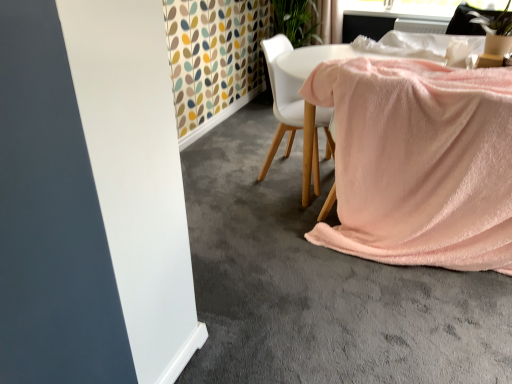
Image resolution: width=512 pixels, height=384 pixels. What do you see at coordinates (316, 58) in the screenshot?
I see `pink soft fabric at center` at bounding box center [316, 58].

Identify the location of pink soft blanket at lower right. This screenshot has height=384, width=512. (319, 284).

Measure the distance between green leafy plant at upper right and camera.

2.68 meters.

Measure the distance between white fabric chair at center and camera.

white fabric chair at center and camera are 7.30 feet apart from each other.

Identify the location of pink soft fabric at center. (316, 58).

How different are the orientations of white fabric chair at center and green leafy plant at upper right in degrees?

The angle between the facing direction of white fabric chair at center and the facing direction of green leafy plant at upper right is 89.3 degrees.

This screenshot has height=384, width=512. I want to click on plant lying above the white fabric chair at center (from the image's perspective), so click(494, 22).

Which object is more forward, white fabric chair at center or green leafy plant at upper right?

green leafy plant at upper right is closer to the camera.

Is white fabric chair at center bigger or smaller than green leafy plant at upper right?

In the image, white fabric chair at center appears to be larger than green leafy plant at upper right.

Considering the relative sizes of pink soft fabric at center and pink soft blanket at lower right in the image provided, is pink soft fabric at center shorter than pink soft blanket at lower right?

No, pink soft fabric at center is not shorter than pink soft blanket at lower right.

Can you tell me how much pink soft fabric at center and pink soft blanket at lower right differ in facing direction?

The facing directions of pink soft fabric at center and pink soft blanket at lower right are 180 degrees apart.

Where is `concrete that appears below the pink soft fabric at center (from the image's perspective)`? The height and width of the screenshot is (384, 512). concrete that appears below the pink soft fabric at center (from the image's perspective) is located at coordinates click(x=319, y=284).

Would you say pink soft fabric at center is a long distance from pink soft blanket at lower right?

No, pink soft fabric at center is in close proximity to pink soft blanket at lower right.

You are a GUI agent. You are given a task and a screenshot of the screen. Output one action in this format:
    pyautogui.click(x=<x>, y=<y>)
    Task: Click on the concrete lying on the right of white fabric chair at center
    This screenshot has width=512, height=384.
    Given the screenshot: What is the action you would take?
    pyautogui.click(x=319, y=284)

Which is closer to the camera, [289,309] or [289,116]?

Point [289,309].

Between pink soft blanket at lower right and white fabric chair at center, which one is positioned in front?

pink soft blanket at lower right is more forward.

Can you confirm if green leafy plant at upper right is positioned to the left of white fabric chair at center?

In fact, green leafy plant at upper right is to the right of white fabric chair at center.

From the image's perspective, between green leafy plant at upper right and white fabric chair at center, which one is located above?

green leafy plant at upper right.

Is green leafy plant at upper right oriented towards white fabric chair at center?

No.

Is white fabric chair at center surrounded by green leafy plant at upper right?

Actually, white fabric chair at center is outside green leafy plant at upper right.

Which is more to the left, pink soft fabric at center or white fabric chair at center?

white fabric chair at center.

How different are the orientations of pink soft fabric at center and white fabric chair at center in degrees?

88.7 degrees.

From the picture: Would you say pink soft fabric at center is outside white fabric chair at center?

That's correct, pink soft fabric at center is outside of white fabric chair at center.

Considering the points (302, 188) and (315, 109), which point is behind, point (302, 188) or point (315, 109)?

Point (302, 188)

Considering the relative sizes of green leafy plant at upper right and pink soft fabric at center in the image provided, is green leafy plant at upper right smaller than pink soft fabric at center?

Yes.

Which object is positioned more to the right, green leafy plant at upper right or pink soft fabric at center?

From the viewer's perspective, green leafy plant at upper right appears more on the right side.

Is point (490, 32) farther from viewer compared to point (325, 58)?

Yes, point (490, 32) is behind point (325, 58).

Considering the positions of objects green leafy plant at upper right and pink soft fabric at center in the image provided, who is in front, green leafy plant at upper right or pink soft fabric at center?

pink soft fabric at center is more forward.

From the picture: From the image's perspective, who appears lower, pink soft blanket at lower right or green leafy plant at upper right?

From the image's view, pink soft blanket at lower right is below.

From a real-world perspective, which object stands above the other?

green leafy plant at upper right, from a real-world perspective.

Find the location of a particular element. The image size is (512, 384). plant above the pink soft blanket at lower right (from a real-world perspective) is located at coordinates (494, 22).

Which of these two, pink soft blanket at lower right or green leafy plant at upper right, stands shorter?

With less height is pink soft blanket at lower right.

What are the coordinates of `chair below the green leafy plant at upper right (from a real-world perspective)` in the screenshot? It's located at (282, 97).

The width and height of the screenshot is (512, 384). What are the coordinates of `concrete below the pink soft fabric at center (from the image's perspective)` in the screenshot? It's located at (319, 284).

Considering their positions, is white fabric chair at center positioned further to green leafy plant at upper right than pink soft fabric at center?

Based on the image, white fabric chair at center appears to be further to green leafy plant at upper right.

Based on their spatial positions, is green leafy plant at upper right or pink soft blanket at lower right further from pink soft fabric at center?

green leafy plant at upper right lies further to pink soft fabric at center than the other object.

When comparing their distances from white fabric chair at center, does green leafy plant at upper right or pink soft fabric at center seem further?

green leafy plant at upper right.

Considering their positions, is green leafy plant at upper right positioned further to pink soft blanket at lower right than white fabric chair at center?

green leafy plant at upper right.

Estimate the real-world distances between objects in this image. Which object is further from white fabric chair at center, pink soft fabric at center or pink soft blanket at lower right?

The object further to white fabric chair at center is pink soft blanket at lower right.

Based on their spatial positions, is white fabric chair at center or pink soft fabric at center closer to pink soft blanket at lower right?

pink soft fabric at center is closer to pink soft blanket at lower right.

When comparing their distances from green leafy plant at upper right, does white fabric chair at center or pink soft blanket at lower right seem closer?

white fabric chair at center is closer to green leafy plant at upper right.

When comparing their distances from white fabric chair at center, does pink soft blanket at lower right or pink soft fabric at center seem further?

pink soft blanket at lower right is further to white fabric chair at center.

I want to click on plant between pink soft blanket at lower right and white fabric chair at center along the z-axis, so click(x=494, y=22).

Locate an element on the screen. table located between pink soft blanket at lower right and white fabric chair at center in the depth direction is located at coordinates (316, 58).

Find the location of `table between white fabric chair at center and green leafy plant at upper right in the horizontal direction`. table between white fabric chair at center and green leafy plant at upper right in the horizontal direction is located at coordinates (316, 58).

Where is `table located between pink soft blanket at lower right and green leafy plant at upper right in the depth direction`? This screenshot has height=384, width=512. table located between pink soft blanket at lower right and green leafy plant at upper right in the depth direction is located at coordinates (316, 58).